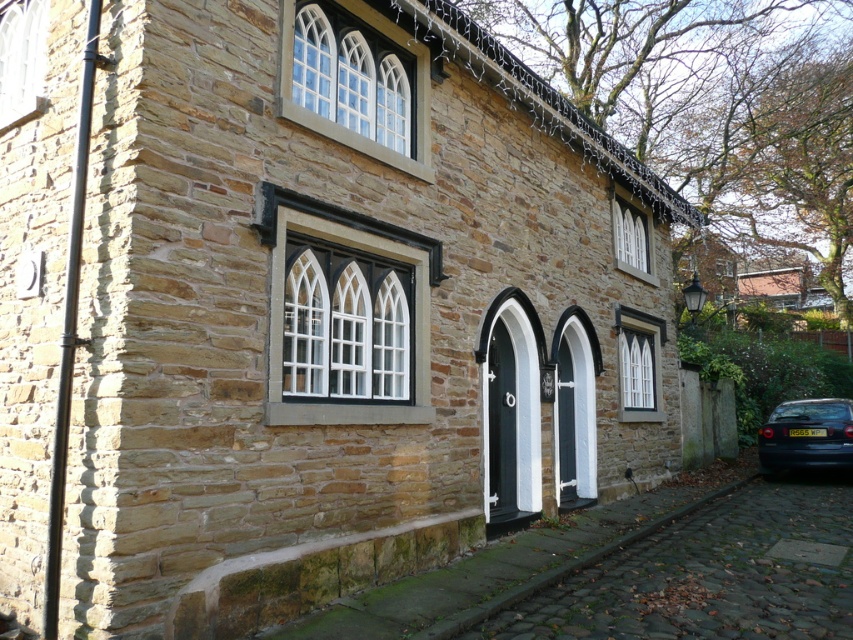
You are standing in front of the stone building and looking at the two points marked on its facade. Which point, point (328,230) or point (407,160), appears closer to you?

Point (328,230) is closer to the camera than point (407,160), so it appears closer to you.

You are an architect examining the building facade. You notice the black glass window at center and the clear glass windows at upper center. Which of these two features is positioned higher up on the building?

The clear glass windows at upper center are positioned higher up on the building because they are located above the black glass window at center.